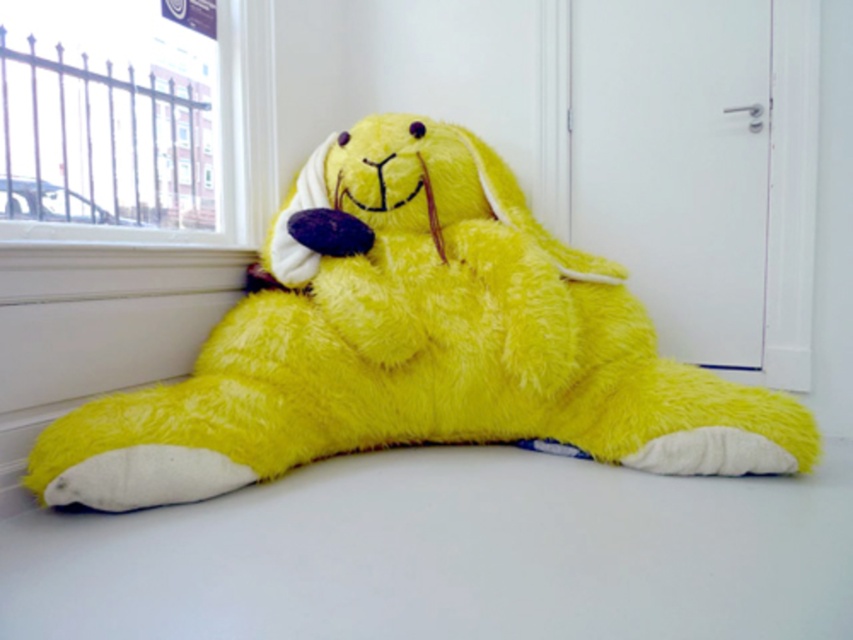
Describe the element at coordinates (415, 346) in the screenshot. I see `fluffy yellow plush at center` at that location.

Is fluffy yellow plush at center taller than metallic fence at upper left?

Yes.

Is point (283, 401) positioned behind point (160, 45)?

No, it is not.

The height and width of the screenshot is (640, 853). In order to click on fluffy yellow plush at center in this screenshot , I will do click(415, 346).